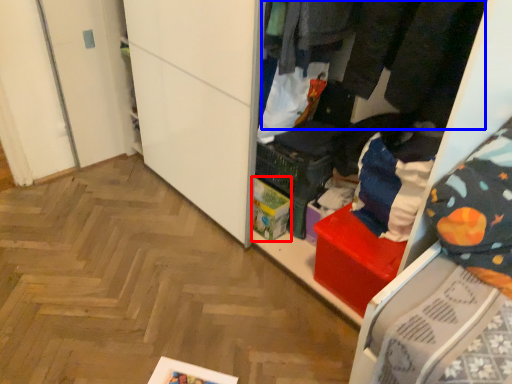
Question: Which point is closer to the camera, storage box (highlighted by a red box) or clothing (highlighted by a blue box)?

Choices:
 (A) storage box
 (B) clothing

Answer: (B)